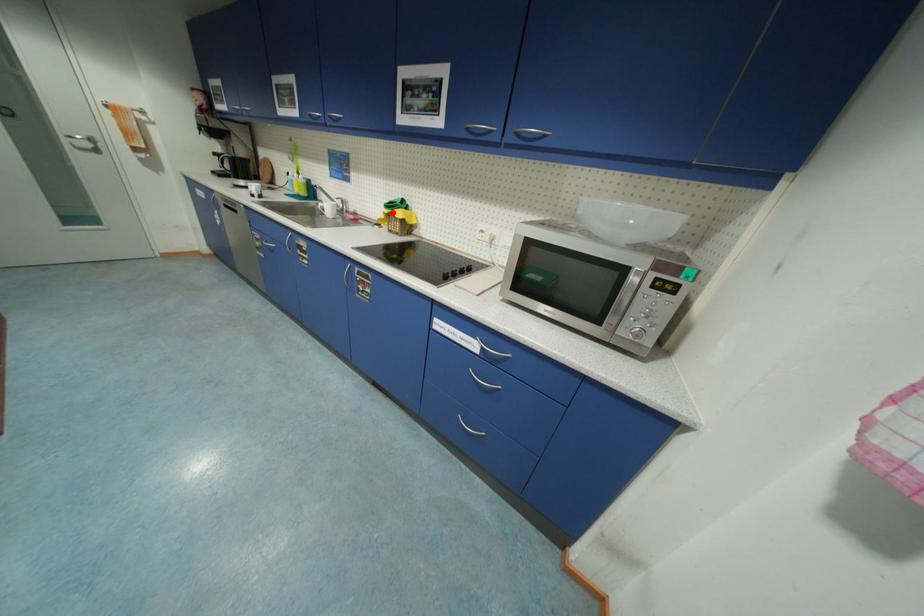
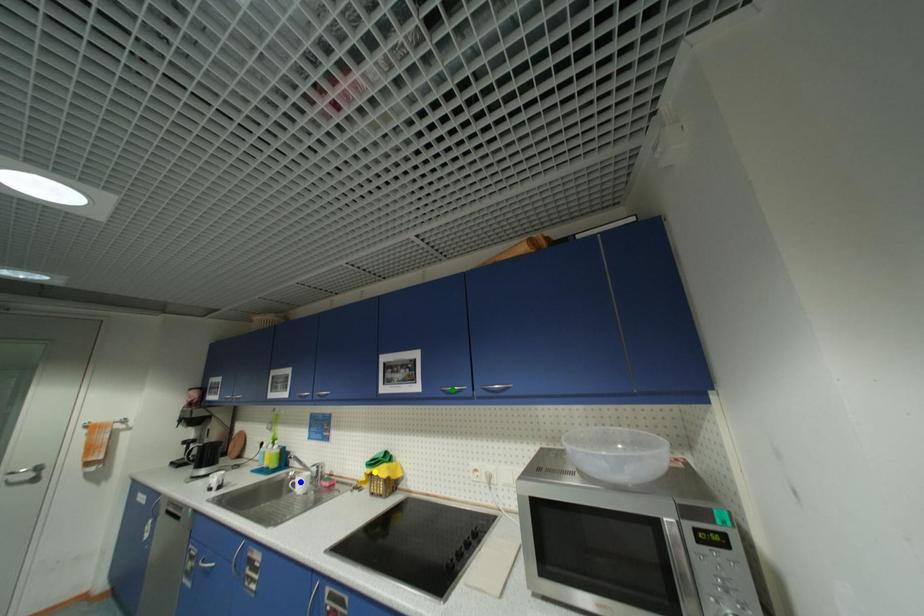
Question: I am providing you with two images of the same scene from different viewpoints. A red point is marked on the first image. You are given multiple points on the second image. Which point in image 2 is actually the same real-world point as the red point in image 1?

Choices:
 (A) yellow point
 (B) green point
 (C) blue point

Answer: (A)